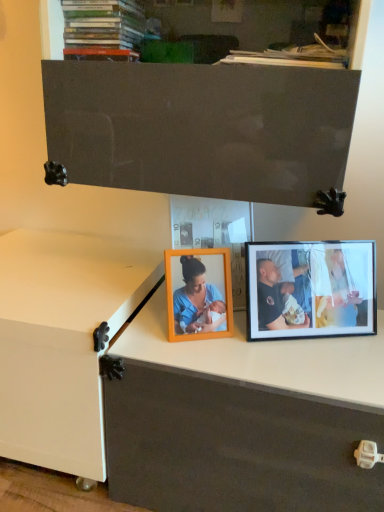
What do you see at coordinates (310, 289) in the screenshot?
I see `black matte photo frame at right` at bounding box center [310, 289].

This screenshot has height=512, width=384. What are the coordinates of `black matte photo frame at right` in the screenshot? It's located at (310, 289).

The width and height of the screenshot is (384, 512). Describe the element at coordinates (61, 342) in the screenshot. I see `white glossy changing table at lower left` at that location.

In order to face white glossy changing table at lower left, should I rotate leftwards or rightwards?

You should look left and rotate roughly 18.627 degrees.

The image size is (384, 512). Find the location of `white glossy changing table at lower left`. white glossy changing table at lower left is located at coordinates (61, 342).

Locate an element on the screen. The image size is (384, 512). black matte photo frame at right is located at coordinates (x=310, y=289).

In the image, is black matte photo frame at right on the left side or the right side of white glossy changing table at lower left?

Clearly, black matte photo frame at right is on the right of white glossy changing table at lower left in the image.

Which is behind, black matte photo frame at right or white glossy changing table at lower left?

Positioned behind is black matte photo frame at right.

Between point (330, 251) and point (123, 323), which one is positioned in front?

The point (123, 323) is closer to the camera.

From the image's perspective, does black matte photo frame at right appear lower than white glossy changing table at lower left?

No.

From a real-world perspective, which is physically above, black matte photo frame at right or white glossy changing table at lower left?

black matte photo frame at right.

Looking at this image, which of these two, black matte photo frame at right or white glossy changing table at lower left, is thinner?

black matte photo frame at right is thinner.

Is black matte photo frame at right shorter than white glossy changing table at lower left?

Yes.

Considering the sizes of objects black matte photo frame at right and white glossy changing table at lower left in the image provided, who is bigger, black matte photo frame at right or white glossy changing table at lower left?

white glossy changing table at lower left is bigger.

Choose the correct answer: Is black matte photo frame at right inside white glossy changing table at lower left or outside it?

black matte photo frame at right exists outside the volume of white glossy changing table at lower left.

Is black matte photo frame at right directly adjacent to white glossy changing table at lower left?

No, black matte photo frame at right is not with white glossy changing table at lower left.

Is black matte photo frame at right facing away from white glossy changing table at lower left?

black matte photo frame at right does not have its back to white glossy changing table at lower left.

Where is `changing table on the left side of black matte photo frame at right`? changing table on the left side of black matte photo frame at right is located at coordinates (61, 342).

Consider the image. Which is more to the left, white glossy changing table at lower left or black matte photo frame at right?

white glossy changing table at lower left is more to the left.

Based on the photo, is the position of white glossy changing table at lower left less distant than that of black matte photo frame at right?

Yes, white glossy changing table at lower left is closer to the viewer.

Considering the positions of points (10, 249) and (268, 334), is point (10, 249) closer to camera compared to point (268, 334)?

No, it is not.

From the image's perspective, which is above, white glossy changing table at lower left or black matte photo frame at right?

From the image's view, black matte photo frame at right is above.

From a real-world perspective, who is located lower, white glossy changing table at lower left or black matte photo frame at right?

white glossy changing table at lower left, from a real-world perspective.

Which object is wider, white glossy changing table at lower left or black matte photo frame at right?

Wider between the two is white glossy changing table at lower left.

Can you confirm if white glossy changing table at lower left is taller than black matte photo frame at right?

Correct, white glossy changing table at lower left is much taller as black matte photo frame at right.

Considering the sizes of objects white glossy changing table at lower left and black matte photo frame at right in the image provided, who is bigger, white glossy changing table at lower left or black matte photo frame at right?

white glossy changing table at lower left is bigger.

Would you say white glossy changing table at lower left is inside or outside black matte photo frame at right?

white glossy changing table at lower left cannot be found inside black matte photo frame at right.

Is white glossy changing table at lower left with black matte photo frame at right?

white glossy changing table at lower left and black matte photo frame at right are not in contact.

Is white glossy changing table at lower left looking in the opposite direction of black matte photo frame at right?

white glossy changing table at lower left does not have its back to black matte photo frame at right.

How different are the orientations of white glossy changing table at lower left and black matte photo frame at right in degrees?

white glossy changing table at lower left and black matte photo frame at right are facing 23.7 degrees away from each other.

At what (x,y) coordinates should I click in order to perform the action: click on picture frame that appears above the white glossy changing table at lower left (from the image's perspective). Please return your answer as a coordinate pair (x, y). The width and height of the screenshot is (384, 512). Looking at the image, I should click on (310, 289).

Locate an element on the screen. This screenshot has width=384, height=512. changing table located on the left of black matte photo frame at right is located at coordinates (61, 342).

The width and height of the screenshot is (384, 512). In order to click on picture frame that is on the right side of white glossy changing table at lower left in this screenshot , I will do `click(310, 289)`.